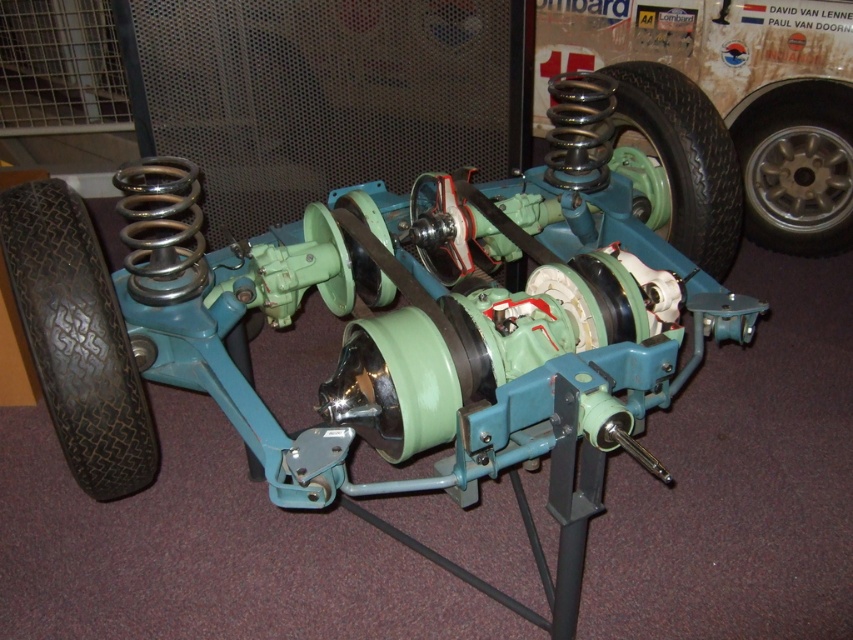
Question: Which object is the farthest from the black rubber tire at center?

Choices:
 (A) metallic silver wheel at right
 (B) black rubber tire at lower left

Answer: (B)

Question: In this image, where is metallic silver wheel at right located relative to black rubber tire at center?

Choices:
 (A) below
 (B) above

Answer: (A)

Question: Is metallic silver wheel at right below black rubber tire at center?

Choices:
 (A) no
 (B) yes

Answer: (B)

Question: Which object appears farthest from the camera in this image?

Choices:
 (A) black rubber tire at center
 (B) metallic silver wheel at right
 (C) black rubber tire at lower left

Answer: (B)

Question: Is metallic silver wheel at right to the left of black rubber tire at center from the viewer's perspective?

Choices:
 (A) yes
 (B) no

Answer: (B)

Question: Which point appears closest to the camera in this image?

Choices:
 (A) [x=57, y=256]
 (B) [x=802, y=157]

Answer: (A)